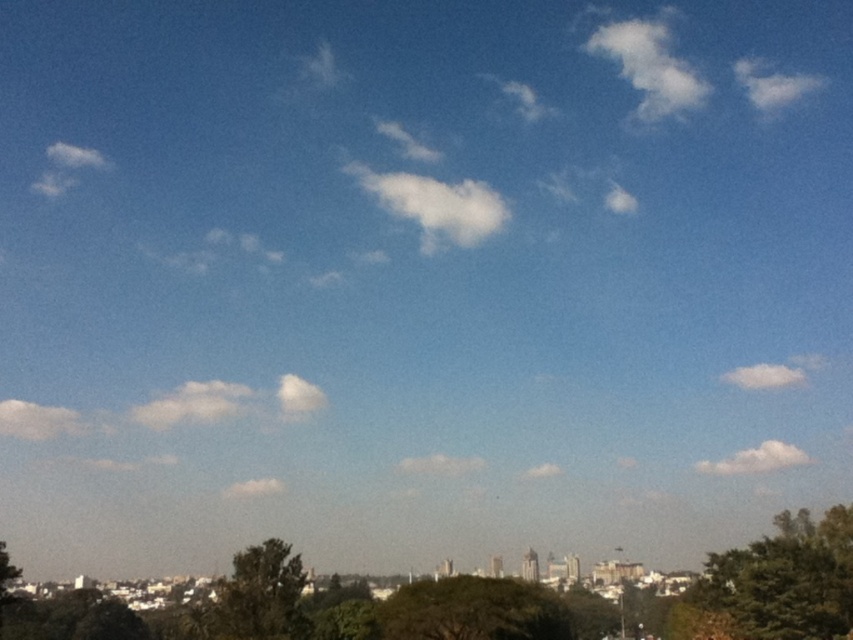
Question: Is green textured tree at lower right below green leafy tree at lower center?

Choices:
 (A) no
 (B) yes

Answer: (B)

Question: Where is green textured tree at lower right located in relation to green leafy tree at center in the image?

Choices:
 (A) left
 (B) right

Answer: (B)

Question: In this image, where is green textured tree at lower right located relative to green leafy tree at lower center?

Choices:
 (A) above
 (B) below

Answer: (B)

Question: Which point is closer to the camera?

Choices:
 (A) green textured tree at lower right
 (B) green leafy tree at lower center

Answer: (A)

Question: Which of the following is the farthest from the observer?

Choices:
 (A) green leafy tree at center
 (B) green textured tree at lower right

Answer: (B)

Question: Which object is positioned closest to the green leafy tree at center?

Choices:
 (A) green leafy tree at lower center
 (B) green textured tree at lower right

Answer: (A)